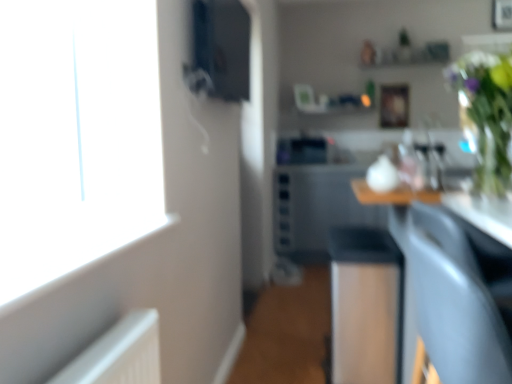
What do you see at coordinates (311, 151) in the screenshot? I see `black glossy sink at center` at bounding box center [311, 151].

Where is `matte gray armchair at lower right`? Image resolution: width=512 pixels, height=384 pixels. matte gray armchair at lower right is located at coordinates (457, 316).

What do you see at coordinates (394, 105) in the screenshot? I see `wooden picture frame at upper center` at bounding box center [394, 105].

The image size is (512, 384). In order to click on black glossy dishwasher at center in this screenshot , I will do `click(366, 305)`.

Can we say matte black speaker at upper center lies outside matte gray armchair at lower right?

Yes.

From a real-world perspective, does matte black speaker at upper center sit lower than matte gray armchair at lower right?

Incorrect, from a real-world perspective, matte black speaker at upper center is higher than matte gray armchair at lower right.

Does point (211, 48) lie in front of point (426, 255)?

That is False.

Can you confirm if matte black speaker at upper center is taller than matte gray armchair at lower right?

Incorrect, the height of matte black speaker at upper center is not larger of that of matte gray armchair at lower right.

Considering the points (219, 28) and (381, 114), which point is behind, point (219, 28) or point (381, 114)?

The point (219, 28) is farther.

Considering the positions of objects matte black speaker at upper center and wooden picture frame at upper center in the image provided, who is more to the left, matte black speaker at upper center or wooden picture frame at upper center?

matte black speaker at upper center.

Can you confirm if matte black speaker at upper center is wider than wooden picture frame at upper center?

Indeed, matte black speaker at upper center has a greater width compared to wooden picture frame at upper center.

You are a GUI agent. You are given a task and a screenshot of the screen. Output one action in this format:
    pyautogui.click(x=<x>, y=<y>)
    Task: Click on the appliance that appears in front of the wooden picture frame at upper center
    The image size is (512, 384).
    Given the screenshot: What is the action you would take?
    click(223, 47)

Based on the photo, can you tell me how much wooden picture frame at upper center and matte gray armchair at lower right differ in facing direction?

They differ by 93.4 degrees in their facing directions.

Does point (385, 107) lie behind point (507, 354)?

Yes, point (385, 107) is behind point (507, 354).

Does wooden picture frame at upper center have a greater height compared to matte gray armchair at lower right?

No.

From the image's perspective, does matte black speaker at upper center appear lower than green glass vase at upper right?

No, from the image's perspective, matte black speaker at upper center is not beneath green glass vase at upper right.

From a real-world perspective, between matte black speaker at upper center and green glass vase at upper right, who is vertically higher?

matte black speaker at upper center.

Between matte black speaker at upper center and green glass vase at upper right, which one appears on the right side from the viewer's perspective?

green glass vase at upper right is more to the right.

Is black glossy sink at center positioned far away from wooden picture frame at upper center?

black glossy sink at center is actually quite close to wooden picture frame at upper center.

Could you tell me if black glossy sink at center is turned towards wooden picture frame at upper center?

No, black glossy sink at center does not turn towards wooden picture frame at upper center.

Can you confirm if black glossy sink at center is smaller than wooden picture frame at upper center?

Incorrect, black glossy sink at center is not smaller in size than wooden picture frame at upper center.

From a real-world perspective, which is physically above, green glass vase at upper right or wooden picture frame at upper center?

wooden picture frame at upper center, from a real-world perspective.

Who is smaller, green glass vase at upper right or wooden picture frame at upper center?

wooden picture frame at upper center.

Between green glass vase at upper right and wooden picture frame at upper center, which one has larger width?

With larger width is green glass vase at upper right.

Between point (479, 122) and point (395, 104), which one is positioned behind?

The point (395, 104) is farther from the camera.

Can you confirm if wooden picture frame at upper center is shorter than black glossy sink at center?

No.

From the image's perspective, does wooden picture frame at upper center appear lower than black glossy sink at center?

No, from the image's perspective, wooden picture frame at upper center is not beneath black glossy sink at center.

Can you confirm if wooden picture frame at upper center is wider than black glossy sink at center?

No, wooden picture frame at upper center is not wider than black glossy sink at center.

Which object is positioned more to the left, wooden picture frame at upper center or black glossy sink at center?

black glossy sink at center is more to the left.

I want to click on appliance on the left side of matte gray armchair at lower right, so click(x=223, y=47).

You are a GUI agent. You are given a task and a screenshot of the screen. Output one action in this format:
    pyautogui.click(x=<x>, y=<y>)
    Task: Click on the appliance above the wooden picture frame at upper center (from a real-world perspective)
    This screenshot has width=512, height=384.
    Given the screenshot: What is the action you would take?
    pyautogui.click(x=223, y=47)

Looking at this image, considering their positions, is green glass vase at upper right positioned further to matte gray armchair at lower right than black glossy dishwasher at center?

Based on the image, black glossy dishwasher at center appears to be further to matte gray armchair at lower right.

Based on their spatial positions, is wooden picture frame at upper center or matte gray armchair at lower right further from black glossy sink at center?

matte gray armchair at lower right.

Considering their positions, is black glossy sink at center positioned further to black glossy dishwasher at center than wooden picture frame at upper center?

Among the two, wooden picture frame at upper center is located further to black glossy dishwasher at center.

Looking at the image, which one is located closer to matte gray armchair at lower right, matte black speaker at upper center or black glossy sink at center?

black glossy sink at center.

Considering their positions, is green glass vase at upper right positioned further to matte gray armchair at lower right than black glossy sink at center?

black glossy sink at center lies further to matte gray armchair at lower right than the other object.

Looking at the image, which one is located further to matte gray armchair at lower right, black glossy dishwasher at center or wooden picture frame at upper center?

The object further to matte gray armchair at lower right is wooden picture frame at upper center.

Estimate the real-world distances between objects in this image. Which object is further from black glossy dishwasher at center, green glass vase at upper right or matte gray armchair at lower right?

matte gray armchair at lower right is further to black glossy dishwasher at center.

Estimate the real-world distances between objects in this image. Which object is closer to black glossy sink at center, black glossy dishwasher at center or matte black speaker at upper center?

matte black speaker at upper center is closer to black glossy sink at center.

At what (x,y) coordinates should I click in order to perform the action: click on armchair between matte black speaker at upper center and green glass vase at upper right. Please return your answer as a coordinate pair (x, y). Looking at the image, I should click on (x=457, y=316).

Locate an element on the screen. The height and width of the screenshot is (384, 512). floral arrangement between matte gray armchair at lower right and black glossy dishwasher at center from front to back is located at coordinates (487, 113).

In order to click on floral arrangement between matte gray armchair at lower right and wooden picture frame at upper center in the front-back direction in this screenshot , I will do `click(487, 113)`.

In order to click on sink between matte gray armchair at lower right and wooden picture frame at upper center along the z-axis in this screenshot , I will do `click(311, 151)`.